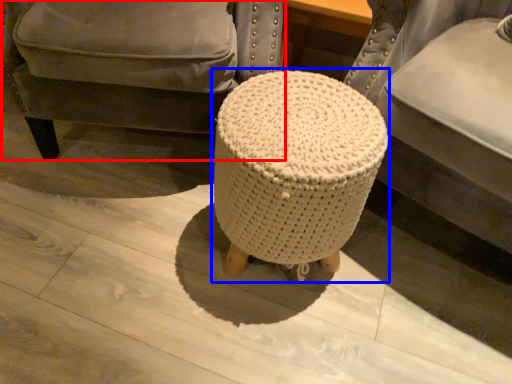
Question: Which of the following is the closest to the observer, chair (highlighted by a red box) or bar stool (highlighted by a blue box)?

Choices:
 (A) chair
 (B) bar stool

Answer: (B)